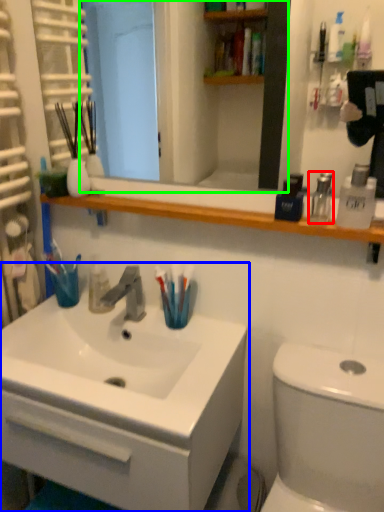
Question: Which object is the farthest from mouthwash (highlighted by a red box)? Choose among these: bathroom cabinet (highlighted by a blue box) or mirror (highlighted by a green box).

Choices:
 (A) bathroom cabinet
 (B) mirror

Answer: (B)